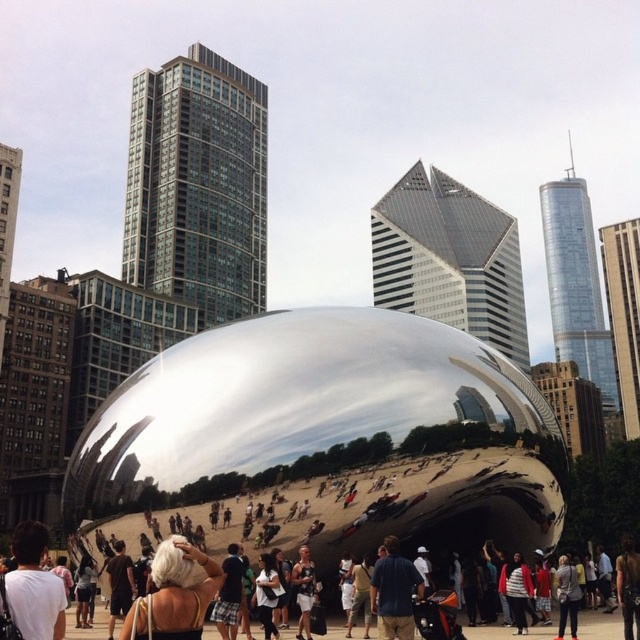
Question: Considering the relative positions of blonde hair at center and blue fabric shirt at center in the image provided, where is blonde hair at center located with respect to blue fabric shirt at center?

Choices:
 (A) above
 (B) below

Answer: (A)

Question: Does blonde hair at center have a greater width compared to blue fabric shirt at center?

Choices:
 (A) yes
 (B) no

Answer: (A)

Question: Which point is farther from the camera taking this photo?

Choices:
 (A) (410, 604)
 (B) (182, 541)

Answer: (A)

Question: Can you confirm if blonde hair at center is positioned to the left of blue fabric shirt at center?

Choices:
 (A) yes
 (B) no

Answer: (A)

Question: Which point is closer to the camera?

Choices:
 (A) blue fabric shirt at center
 (B) blonde hair at center

Answer: (B)